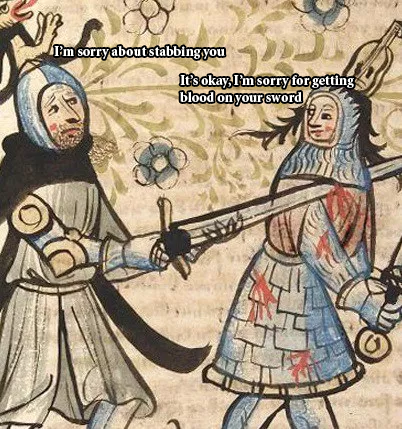
The width and height of the screenshot is (402, 429). What are the coordinates of `flower designs in the background` in the screenshot? It's located at (166, 150), (330, 17), (153, 21).